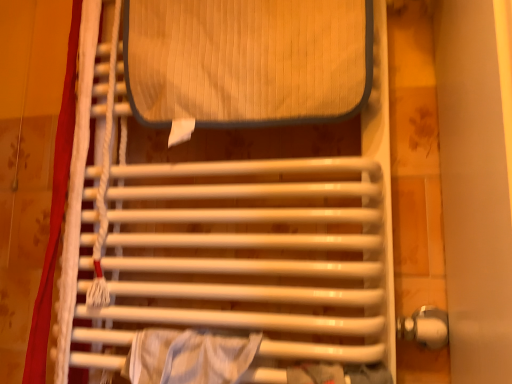
Question: Is white glossy towel rack at center beside white fabric curtain at left?

Choices:
 (A) yes
 (B) no

Answer: (B)

Question: From the image's perspective, is white glossy towel rack at center under white fabric curtain at left?

Choices:
 (A) no
 (B) yes

Answer: (A)

Question: Is white glossy towel rack at center at the right side of white fabric curtain at left?

Choices:
 (A) no
 (B) yes

Answer: (B)

Question: Is white glossy towel rack at center aimed at white fabric curtain at left?

Choices:
 (A) yes
 (B) no

Answer: (B)

Question: Does white glossy towel rack at center have a larger size compared to white fabric curtain at left?

Choices:
 (A) yes
 (B) no

Answer: (A)

Question: Is white glossy towel rack at center outside of white fabric curtain at left?

Choices:
 (A) no
 (B) yes

Answer: (B)

Question: Is white fabric curtain at left wider than white glossy towel rack at center?

Choices:
 (A) no
 (B) yes

Answer: (A)

Question: From a real-world perspective, is white fabric curtain at left below white glossy towel rack at center?

Choices:
 (A) no
 (B) yes

Answer: (B)

Question: Is white fabric curtain at left surrounding white glossy towel rack at center?

Choices:
 (A) no
 (B) yes

Answer: (A)

Question: Is white fabric curtain at left at the left side of white glossy towel rack at center?

Choices:
 (A) yes
 (B) no

Answer: (A)

Question: From the image's perspective, is white fabric curtain at left located beneath white glossy towel rack at center?

Choices:
 (A) yes
 (B) no

Answer: (A)

Question: Considering the relative sizes of white fabric curtain at left and white glossy towel rack at center in the image provided, is white fabric curtain at left shorter than white glossy towel rack at center?

Choices:
 (A) yes
 (B) no

Answer: (B)

Question: From the image's perspective, is white fabric curtain at left positioned above or below white glossy towel rack at center?

Choices:
 (A) above
 (B) below

Answer: (B)